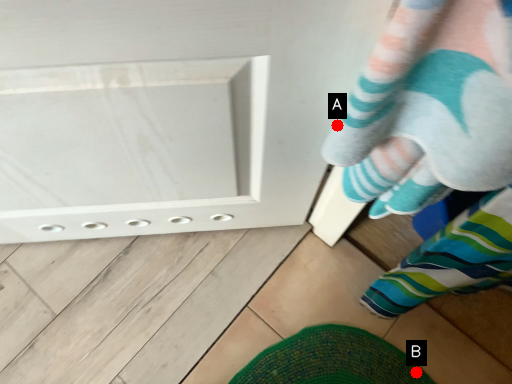
Question: Two points are circled on the image, labeled by A and B beside each circle. Which point is closer to the camera taking this photo?

Choices:
 (A) A is closer
 (B) B is closer

Answer: (A)